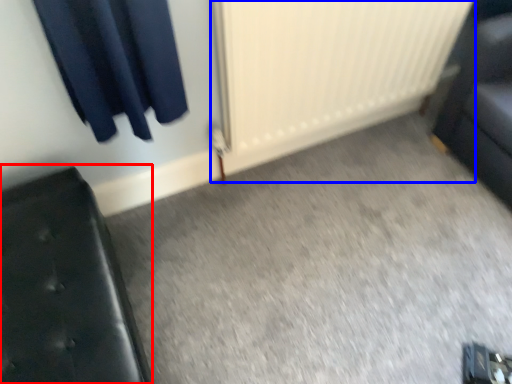
Question: Which point is further to the camera, furniture (highlighted by a red box) or radiator (highlighted by a blue box)?

Choices:
 (A) furniture
 (B) radiator

Answer: (B)